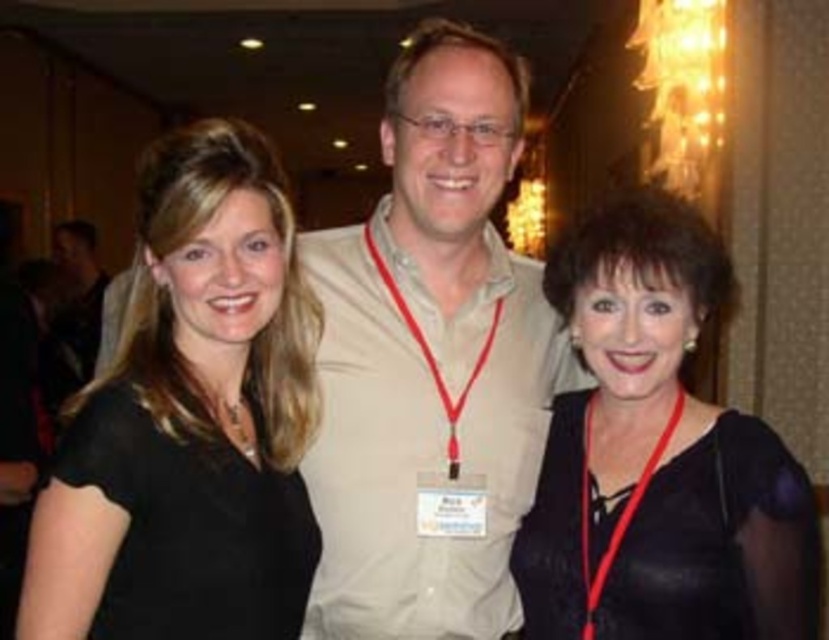
Which of these two, beige cotton shirt at center or black leather dress at right, stands taller?

With more height is beige cotton shirt at center.

Can you confirm if beige cotton shirt at center is bigger than black leather dress at right?

Yes.

Find the location of a particular element. beige cotton shirt at center is located at coordinates (430, 362).

Can you confirm if beige cotton shirt at center is positioned to the right of black matte shirt at left?

Yes, beige cotton shirt at center is to the right of black matte shirt at left.

Does beige cotton shirt at center have a lesser width compared to black matte shirt at left?

No, beige cotton shirt at center is not thinner than black matte shirt at left.

Image resolution: width=829 pixels, height=640 pixels. What are the coordinates of `beige cotton shirt at center` in the screenshot? It's located at (430, 362).

This screenshot has height=640, width=829. Identify the location of beige cotton shirt at center. (430, 362).

Which of these two, black matte shirt at left or black leather dress at right, stands taller?

black matte shirt at left

How much distance is there between black matte shirt at left and black leather dress at right?

25.39 inches

Where is `black matte shirt at left`? black matte shirt at left is located at coordinates (190, 419).